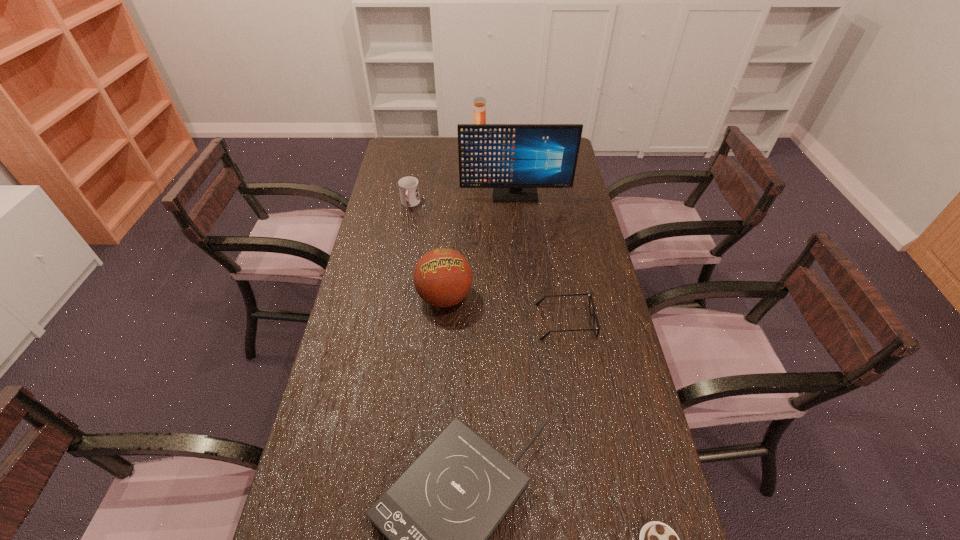
This screenshot has height=540, width=960. I want to click on vacant area that lies between the third shortest object and the sixth shortest object, so click(522, 240).

Locate an element on the screen. The height and width of the screenshot is (540, 960). free space between the basketball and the spectacles is located at coordinates (505, 310).

Locate an element on the screen. object that is the closest to the spectacles is located at coordinates (442, 277).

Find the location of `object that ranks as the second closest to the fifth tallest object`. object that ranks as the second closest to the fifth tallest object is located at coordinates (438, 515).